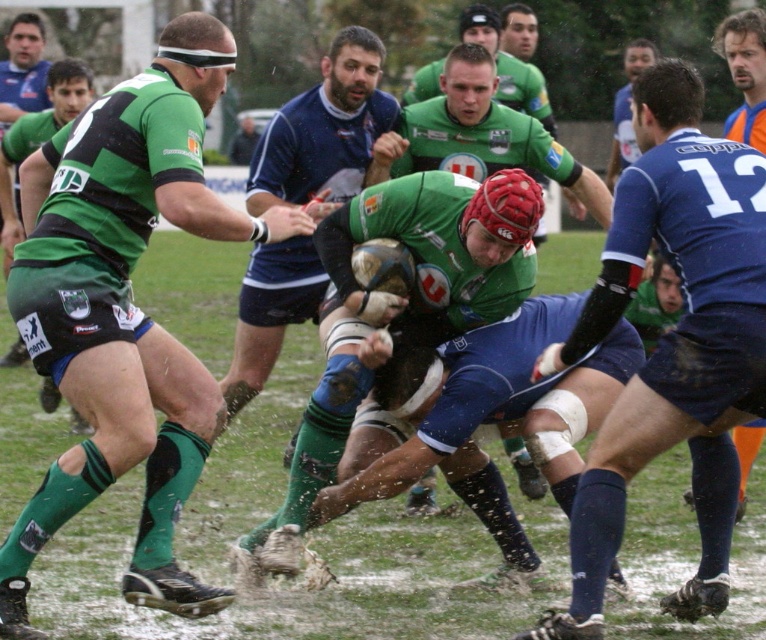
Question: Does green jersey at center lie in front of blue matte jersey at center?

Choices:
 (A) yes
 (B) no

Answer: (B)

Question: Can you confirm if green jersey at center is positioned to the right of blue matte jersey at center?

Choices:
 (A) no
 (B) yes

Answer: (A)

Question: Can you confirm if green jersey at center is positioned to the left of blue matte jersey at center?

Choices:
 (A) no
 (B) yes

Answer: (B)